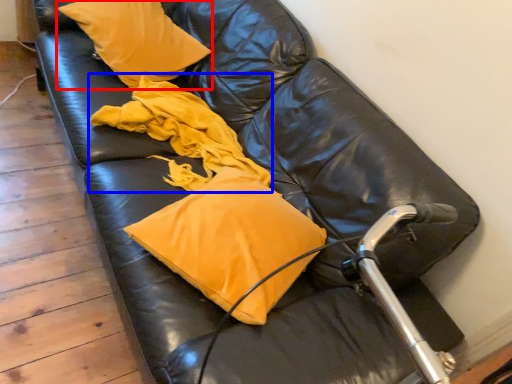
Question: Which of the following is the farthest to the observer, pillow (highlighted by a red box) or material (highlighted by a blue box)?

Choices:
 (A) pillow
 (B) material

Answer: (A)